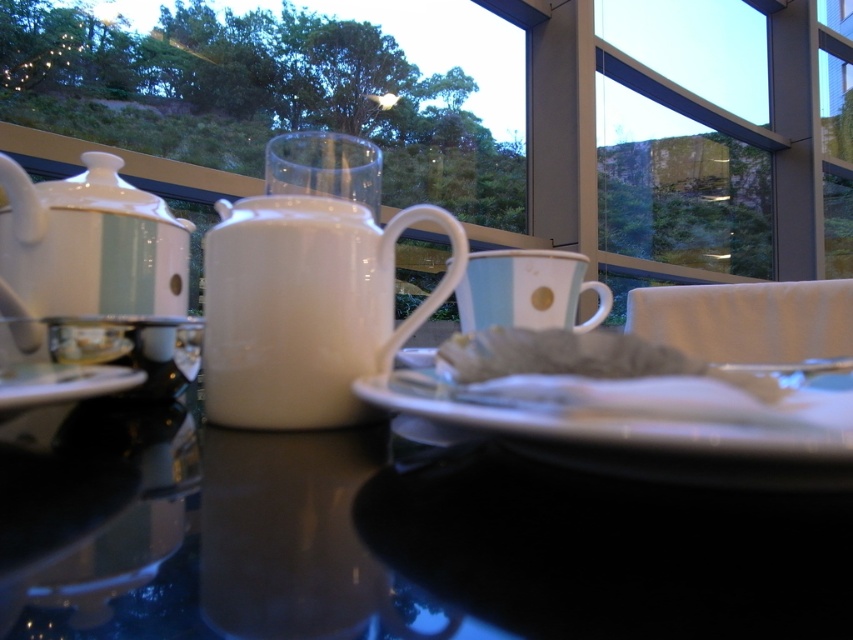
In the scene shown: You are setting up a tea service and want to place a teacup on the saucer. Given the current arrangement, can you easily slide the white glossy saucer at lower left under the light blue ceramic mug at center without moving other items?

The white glossy saucer at lower left is behind the light blue ceramic mug at center, so you can slide the saucer forward to position it under the mug without needing to move other items.

From the picture: You are a waiter trying to place a small dish on the table without covering any existing items. The coordinates of the table are given as a grid from 0 to 1 in both x and y axes. You want to place it at point [647,408]. Is this location safe?

The point [647,408] is on the white glossy plate at center, so placing the dish there would cover the existing items on the plate. Choose another spot.